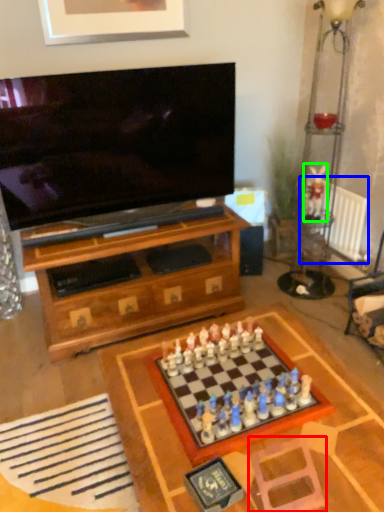
Question: Based on their relative distances, which object is nearer to swivel chair (highlighted by a red box)? Choose from radiator (highlighted by a blue box) and toy (highlighted by a green box).

Choices:
 (A) radiator
 (B) toy

Answer: (A)